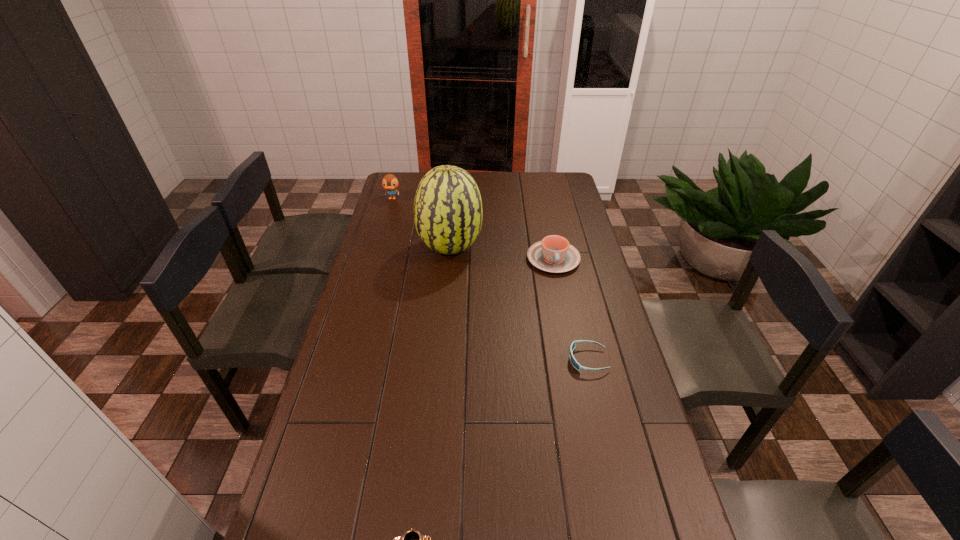
Locate an element on the screen. Image resolution: width=960 pixels, height=540 pixels. vacant position located 0.130m on the front-facing side of the goggles is located at coordinates (527, 360).

Image resolution: width=960 pixels, height=540 pixels. Find the location of `vacant area located 0.400m on the front-facing side of the goggles`. vacant area located 0.400m on the front-facing side of the goggles is located at coordinates (442, 360).

I want to click on object that is at the far edge, so click(390, 183).

Locate an element on the screen. The height and width of the screenshot is (540, 960). object that is at the left edge is located at coordinates (390, 183).

Locate an element on the screen. The width and height of the screenshot is (960, 540). chinaware at the right edge is located at coordinates 554,254.

The image size is (960, 540). Find the location of `goggles that is positioned at the right edge`. goggles that is positioned at the right edge is located at coordinates (573, 345).

Locate an element on the screen. The image size is (960, 540). object positioned at the far left corner is located at coordinates (390, 183).

This screenshot has width=960, height=540. In the image, there is a desktop. What are the coordinates of `blank space at the far edge` in the screenshot? It's located at (486, 175).

Where is `vacant space at the left edge of the desktop`? The height and width of the screenshot is (540, 960). vacant space at the left edge of the desktop is located at coordinates (331, 480).

Identify the location of free space at the right edge. Image resolution: width=960 pixels, height=540 pixels. (581, 303).